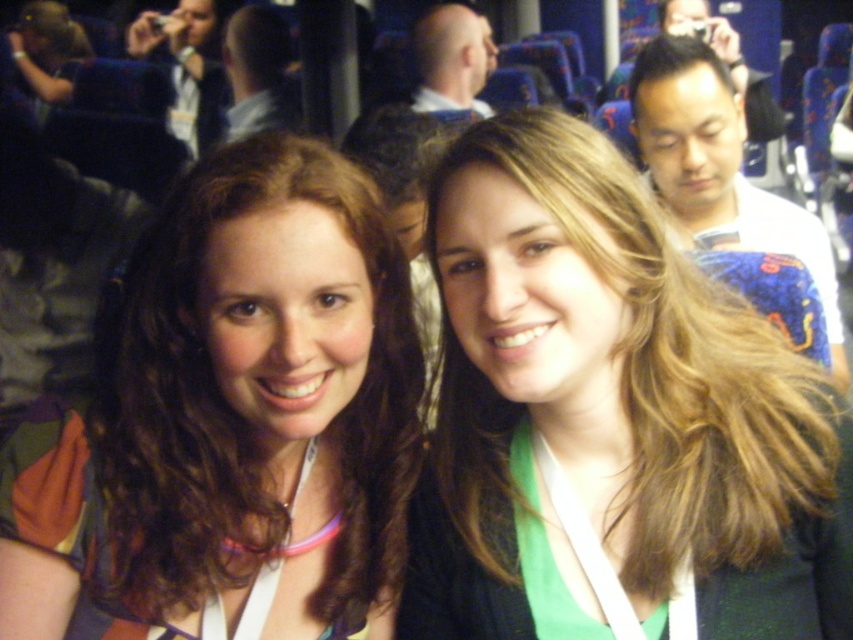
What is the color of the object located at point (256,74)?

The smooth gray shirt at upper center is located at point (256,74), so the color is gray.